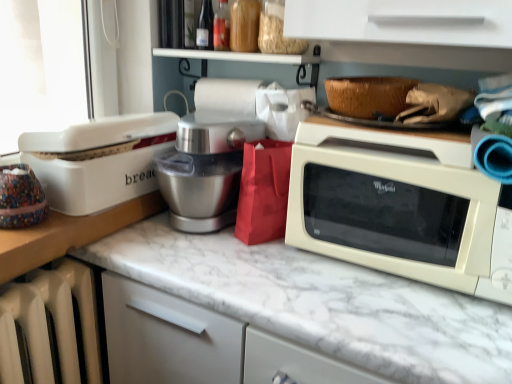
I want to click on vacant area that is in front of white glossy microwave at right, so click(x=408, y=324).